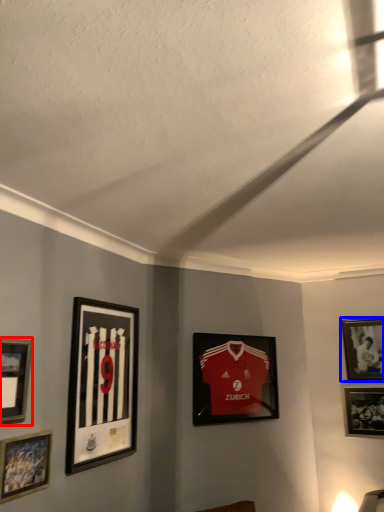
Question: Which of the following is the closest to the observer, picture frame (highlighted by a red box) or picture frame (highlighted by a blue box)?

Choices:
 (A) picture frame
 (B) picture frame

Answer: (A)